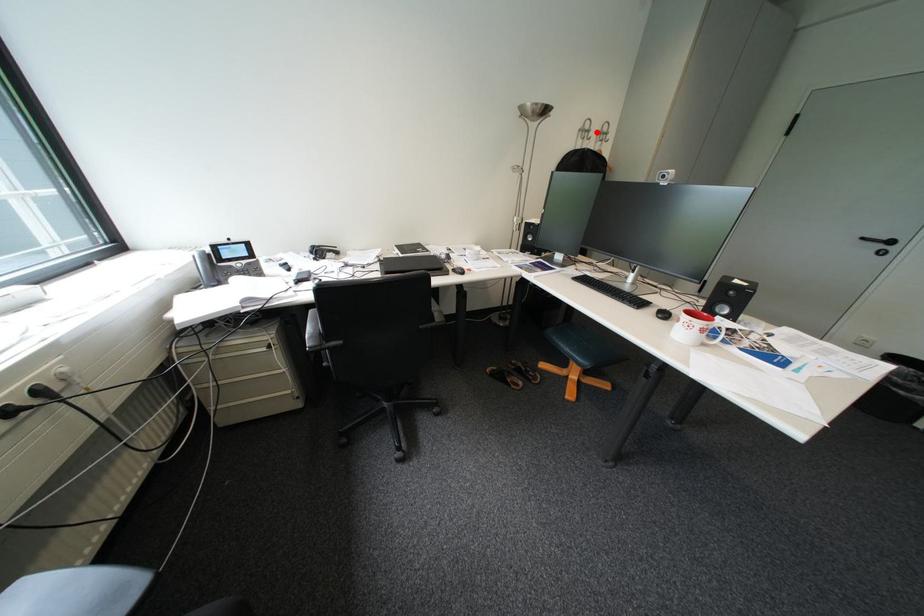
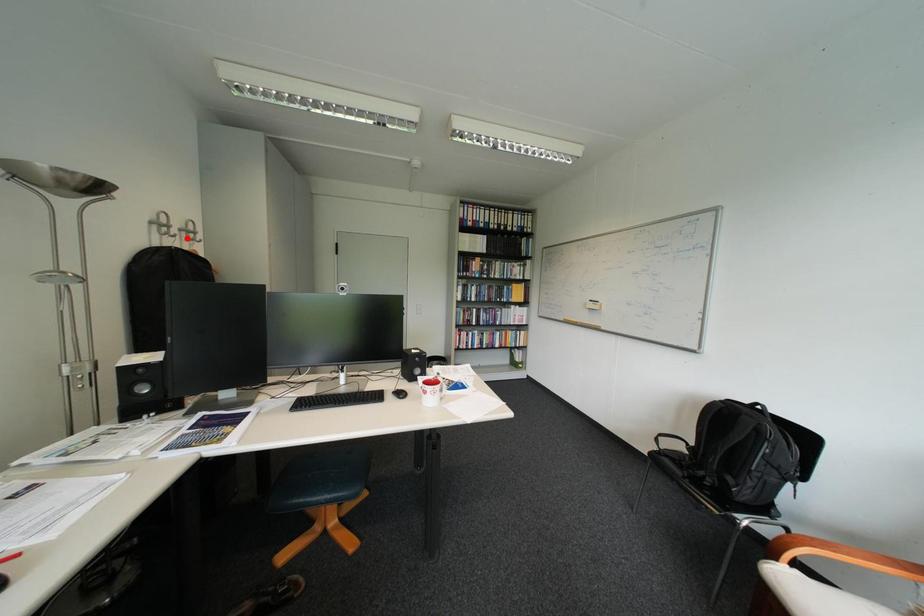
I am providing you with two images of the same scene from different viewpoints. A red point is marked on the first image and another point is marked on the second image. Are the points marked in image1 and image2 representing the same 3D position?

No